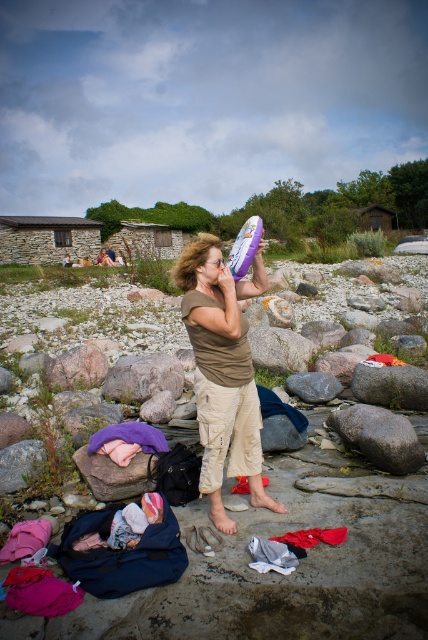
You are a photographer trying to capture the woman and the items around her. You want to ensure the gray rough rock at center and the white cotton clothes at center are both visible in the frame. Based on their positions, which object should you focus on first to make sure both are in focus?

The gray rough rock at center is in front of the white cotton clothes at center. To ensure both are in focus, you should focus on the gray rough rock at center first since it is closer to the camera.

You are standing at the same spot as the woman in the image and want to pick up an item. If you first look towards point A at point (151, 353) and then look towards point B at point (281, 536), which point is closer to you?

Point A at point (151, 353) is closer to you because it is further to the viewer than point B at point (281, 536).